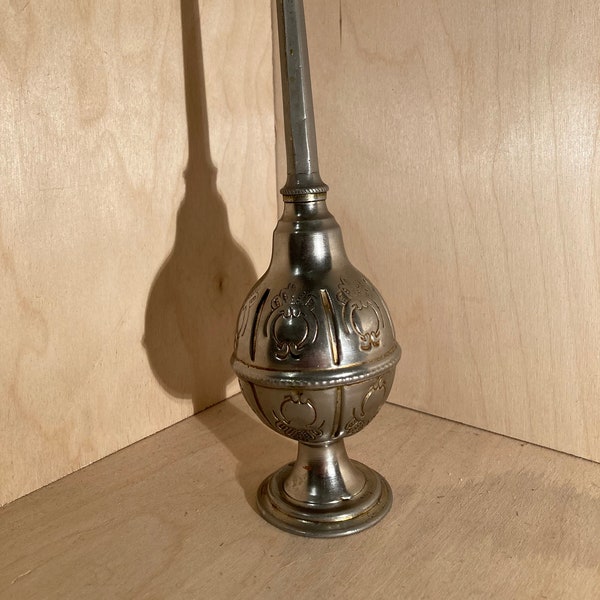
This screenshot has height=600, width=600. What are the coordinates of `shelf` in the screenshot? It's located at (440, 555).